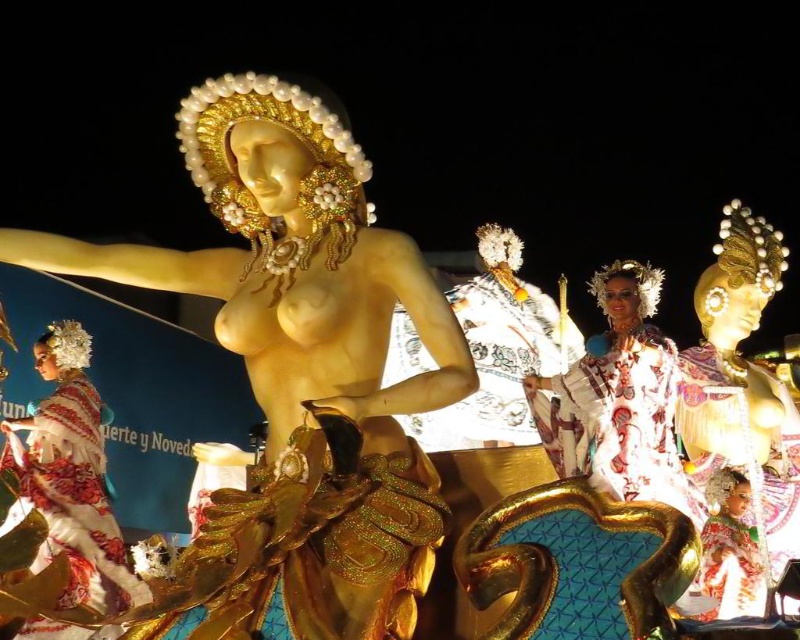
Can you confirm if gold polished statue at center is bigger than embroidered silk dress at lower left?

Indeed, gold polished statue at center has a larger size compared to embroidered silk dress at lower left.

Based on the photo, can you confirm if gold polished statue at center is shorter than embroidered silk dress at lower left?

No.

The height and width of the screenshot is (640, 800). I want to click on gold polished statue at center, so click(x=296, y=374).

Does gold polished statue at center have a smaller size compared to gold metallic statue at center?

Incorrect, gold polished statue at center is not smaller in size than gold metallic statue at center.

Can you confirm if gold polished statue at center is positioned to the right of gold metallic statue at center?

Incorrect, gold polished statue at center is not on the right side of gold metallic statue at center.

Where is `gold polished statue at center`? gold polished statue at center is located at coordinates point(296,374).

Is point (738, 240) positioned before point (34, 470)?

No, it is not.

The height and width of the screenshot is (640, 800). In order to click on gold metallic statue at center in this screenshot , I will do `click(742, 387)`.

Image resolution: width=800 pixels, height=640 pixels. Find the location of `gold metallic statue at center`. gold metallic statue at center is located at coordinates (742, 387).